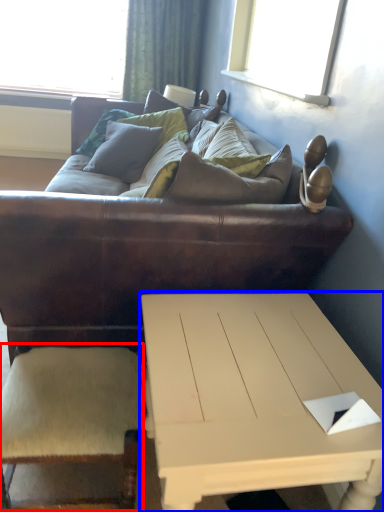
Question: Among these objects, which one is nearest to the camera, armchair (highlighted by a red box) or coffee table (highlighted by a blue box)?

Choices:
 (A) armchair
 (B) coffee table

Answer: (B)